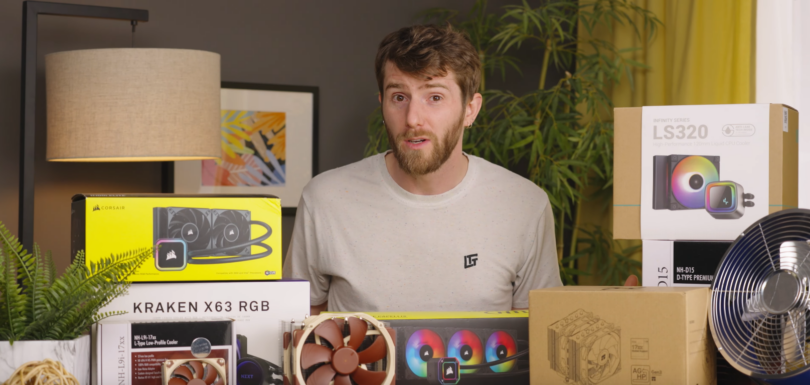
The image size is (810, 385). What are the coordinates of `white planter` in the screenshot? It's located at (62, 361).